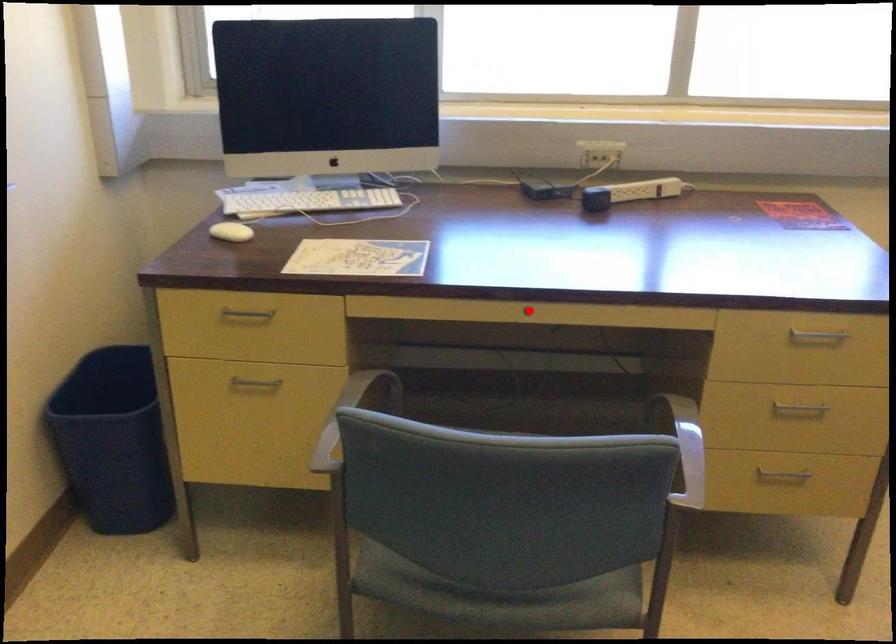
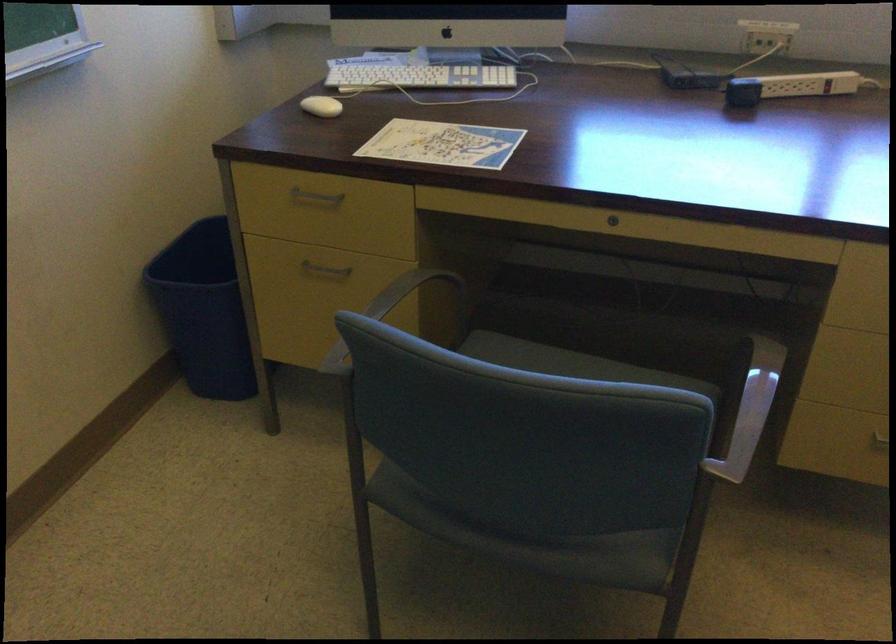
In the second image, find the point that corresponds to the highlighted location in the first image.

(613, 220)